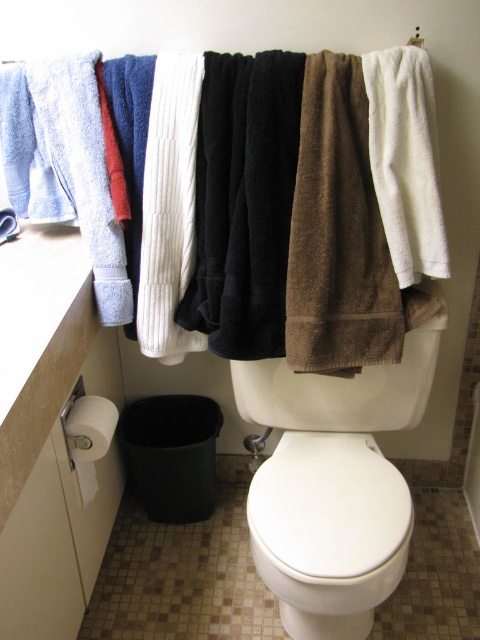
Is terry cloth towels at upper center closer to camera compared to white glossy toilet lid at center?

No, terry cloth towels at upper center is further to the viewer.

Between terry cloth towels at upper center and white glossy toilet lid at center, which one is positioned lower?

Positioned lower is white glossy toilet lid at center.

Who is more forward, [397,212] or [287,474]?

Point [397,212]

Find the location of `terry cloth towels at upper center`. terry cloth towels at upper center is located at coordinates (350, 212).

Locate an element on the screen. brown cotton towel at center is located at coordinates (337, 234).

Who is higher up, brown cotton towel at center or white glossy toilet lid at center?

Positioned higher is brown cotton towel at center.

Where is `brown cotton towel at center`? This screenshot has height=640, width=480. brown cotton towel at center is located at coordinates point(337,234).

Based on the photo, which is more to the left, white glossy toilet lid at center or white fluffy towel at upper right?

From the viewer's perspective, white glossy toilet lid at center appears more on the left side.

Does white glossy toilet lid at center appear under white fluffy towel at upper right?

Indeed, white glossy toilet lid at center is positioned under white fluffy towel at upper right.

This screenshot has width=480, height=640. Find the location of `white glossy toilet lid at center`. white glossy toilet lid at center is located at coordinates click(x=328, y=506).